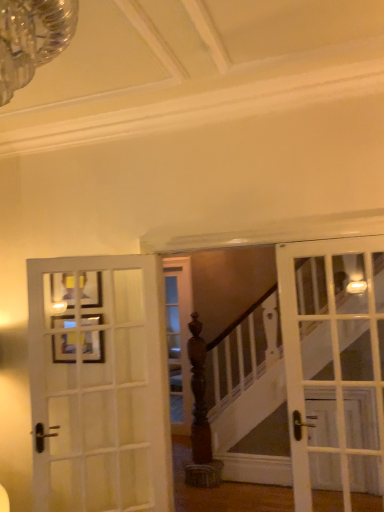
Question: Is wooden picture frame at upper left further to the viewer compared to white wood door at left, arranged as the 2th door when viewed from the right?

Choices:
 (A) yes
 (B) no

Answer: (A)

Question: From a real-world perspective, is wooden picture frame at upper left physically below white wood door at left, arranged as the 1th door when viewed from the left?

Choices:
 (A) no
 (B) yes

Answer: (A)

Question: Is wooden picture frame at upper left at the left side of white wood door at left, arranged as the 1th door when viewed from the left?

Choices:
 (A) no
 (B) yes

Answer: (B)

Question: Does wooden picture frame at upper left touch white wood door at left, arranged as the 1th door when viewed from the left?

Choices:
 (A) yes
 (B) no

Answer: (B)

Question: Does wooden picture frame at upper left have a larger size compared to white wood door at left, arranged as the 2th door when viewed from the right?

Choices:
 (A) yes
 (B) no

Answer: (B)

Question: From a real-world perspective, is white glass door at right, marked as the first door in a right-to-left arrangement, above or below wooden picture frame at upper left?

Choices:
 (A) below
 (B) above

Answer: (A)

Question: Looking at the image, does white glass door at right, marked as the first door in a right-to-left arrangement, seem bigger or smaller compared to wooden picture frame at upper left?

Choices:
 (A) big
 (B) small

Answer: (A)

Question: Is point (281, 300) closer or farther from the camera than point (64, 314)?

Choices:
 (A) farther
 (B) closer

Answer: (B)

Question: Is white glass door at right, marked as the first door in a right-to-left arrangement, taller or shorter than wooden picture frame at upper left?

Choices:
 (A) tall
 (B) short

Answer: (A)

Question: From the image's perspective, is wooden picture frame at upper left above or below white wood door at left, arranged as the 2th door when viewed from the right?

Choices:
 (A) below
 (B) above

Answer: (B)

Question: Considering the positions of point (54, 324) and point (54, 366), is point (54, 324) closer or farther from the camera than point (54, 366)?

Choices:
 (A) closer
 (B) farther

Answer: (A)

Question: Considering the positions of wooden picture frame at upper left and white wood door at left, arranged as the 1th door when viewed from the left, in the image, is wooden picture frame at upper left bigger or smaller than white wood door at left, arranged as the 1th door when viewed from the left,?

Choices:
 (A) big
 (B) small

Answer: (B)

Question: From their relative heights in the image, would you say wooden picture frame at upper left is taller or shorter than white wood door at left, arranged as the 2th door when viewed from the right?

Choices:
 (A) short
 (B) tall

Answer: (A)

Question: From a real-world perspective, is white wood door at left, arranged as the 2th door when viewed from the right, positioned above or below white glass door at right, the 2th door when ordered from left to right?

Choices:
 (A) above
 (B) below

Answer: (B)

Question: In terms of size, does white wood door at left, arranged as the 2th door when viewed from the right, appear bigger or smaller than white glass door at right, marked as the first door in a right-to-left arrangement?

Choices:
 (A) big
 (B) small

Answer: (A)